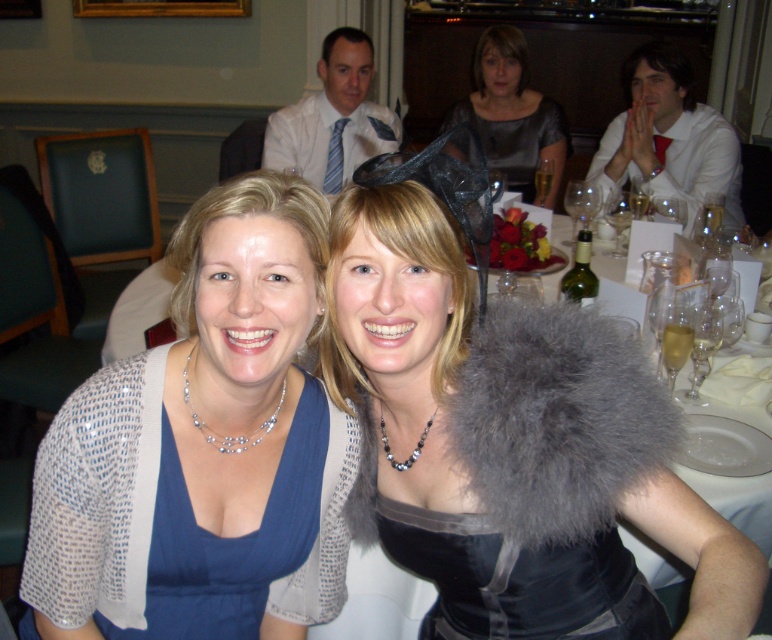
The width and height of the screenshot is (772, 640). I want to click on shiny silver dress at upper center, so click(x=510, y=113).

You are a GUI agent. You are given a task and a screenshot of the screen. Output one action in this format:
    pyautogui.click(x=<x>, y=<y>)
    Task: Click on the shiny silver dress at upper center
    This screenshot has width=772, height=640.
    Given the screenshot: What is the action you would take?
    pyautogui.click(x=510, y=113)

Is matte white shirt at upper center positioned behind shiny silver dress at upper center?

No, matte white shirt at upper center is closer to the viewer.

Between matte white shirt at upper center and shiny silver dress at upper center, which one appears on the right side from the viewer's perspective?

shiny silver dress at upper center is more to the right.

Is point (357, 93) more distant than point (479, 72)?

No, (357, 93) is in front of (479, 72).

You are a GUI agent. You are given a task and a screenshot of the screen. Output one action in this format:
    pyautogui.click(x=<x>, y=<y>)
    Task: Click on the matte white shirt at upper center
    This screenshot has height=640, width=772.
    Given the screenshot: What is the action you would take?
    pyautogui.click(x=332, y=116)

Is point (567, 612) farther from camera compared to point (615, 208)?

No, it is not.

In the scene shown: Is velvet black dress at center to the right of clear glass wine glass at center from the viewer's perspective?

Incorrect, velvet black dress at center is not on the right side of clear glass wine glass at center.

Is point (522, 636) closer to camera compared to point (625, 225)?

That is True.

Identify the location of velvet black dress at center. The width and height of the screenshot is (772, 640). (517, 580).